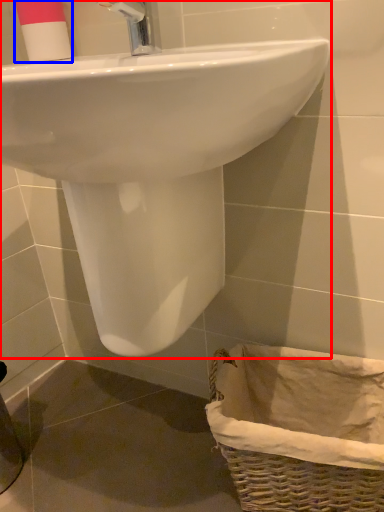
Question: Which point is further to the camera, sink (highlighted by a red box) or toiletry (highlighted by a blue box)?

Choices:
 (A) sink
 (B) toiletry

Answer: (B)